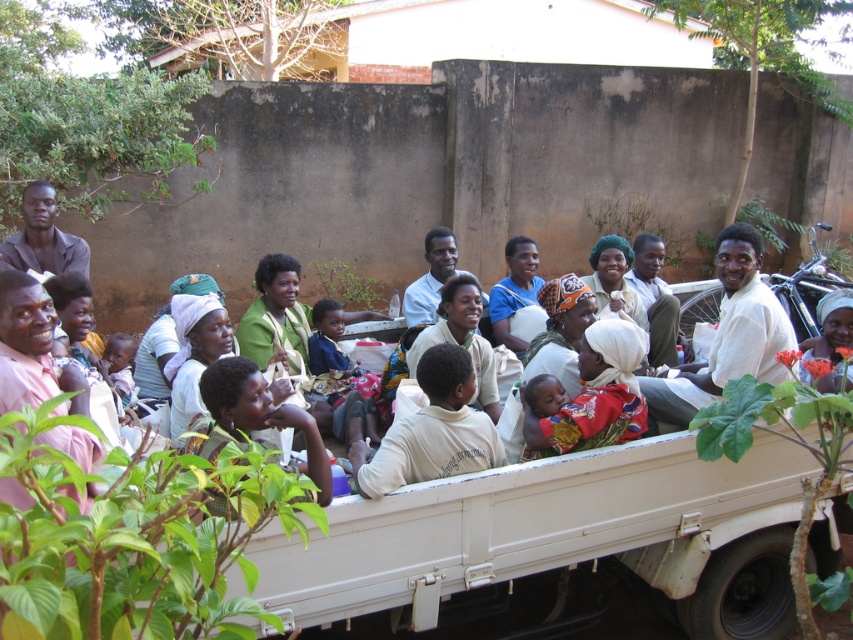
Which of these two, pink matte shirt at left or matte brown shirt at left, stands taller?

pink matte shirt at left is taller.

Does point (73, 444) come farther from viewer compared to point (45, 211)?

That is False.

Image resolution: width=853 pixels, height=640 pixels. Identify the location of pink matte shirt at left. (32, 349).

Locate an element on the screen. The height and width of the screenshot is (640, 853). white matte shirt at center is located at coordinates (728, 336).

Is white matte shirt at center shorter than light brown skin at center?

In fact, white matte shirt at center may be taller than light brown skin at center.

In order to click on white matte shirt at center in this screenshot , I will do `click(728, 336)`.

This screenshot has width=853, height=640. Identify the location of white matte shirt at center. (728, 336).

Can you confirm if white matte shirt at center is wider than pink matte shirt at left?

Correct, the width of white matte shirt at center exceeds that of pink matte shirt at left.

What do you see at coordinates (728, 336) in the screenshot? The height and width of the screenshot is (640, 853). I see `white matte shirt at center` at bounding box center [728, 336].

What do you see at coordinates (728, 336) in the screenshot? This screenshot has height=640, width=853. I see `white matte shirt at center` at bounding box center [728, 336].

Identify the location of white matte shirt at center. (728, 336).